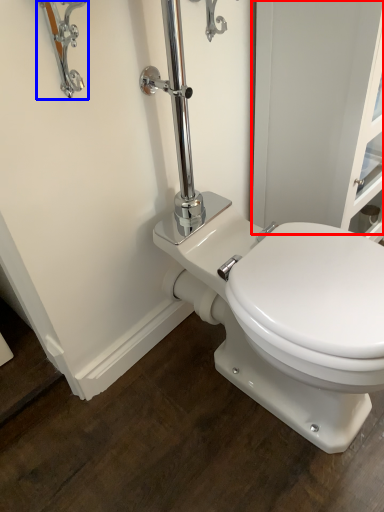
Question: Which point is further to the camera, screen door (highlighted by a red box) or faucet (highlighted by a blue box)?

Choices:
 (A) screen door
 (B) faucet

Answer: (A)